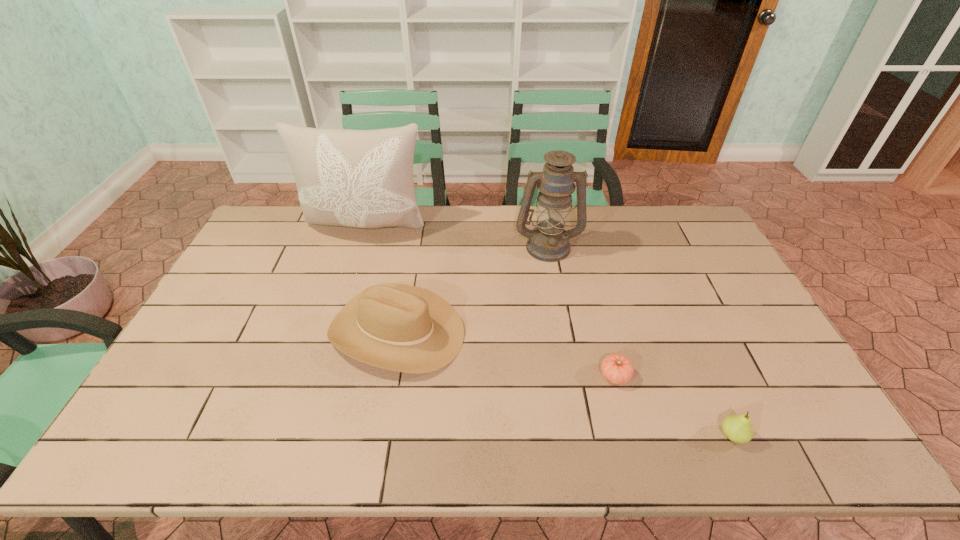
I want to click on vacant point located between the third shortest object and the tomato, so click(506, 353).

What are the coordinates of `free space between the third tallest object and the shortest object` in the screenshot? It's located at (506, 353).

This screenshot has width=960, height=540. Identify the location of unoccupied position between the nearest object and the tomato. (674, 406).

Locate an element on the screen. Image resolution: width=960 pixels, height=540 pixels. empty location between the cushion and the tomato is located at coordinates (491, 301).

What are the coordinates of `blank region between the tomato and the pear` in the screenshot? It's located at (674, 406).

Where is `free space between the fourth tallest object and the third tallest object`? The image size is (960, 540). free space between the fourth tallest object and the third tallest object is located at coordinates (564, 383).

This screenshot has width=960, height=540. I want to click on vacant region between the shortest object and the third shortest object, so click(506, 353).

Locate an element on the screen. free space between the fourth tallest object and the cushion is located at coordinates pos(550,331).

You are a GUI agent. You are given a task and a screenshot of the screen. Output one action in this format:
    pyautogui.click(x=<x>, y=<y>)
    Task: Click on the free space between the cushion and the nearest object
    The image size is (960, 540).
    Given the screenshot: What is the action you would take?
    pyautogui.click(x=550, y=331)

This screenshot has width=960, height=540. Identify the location of the second closest object to the tomato. (399, 327).